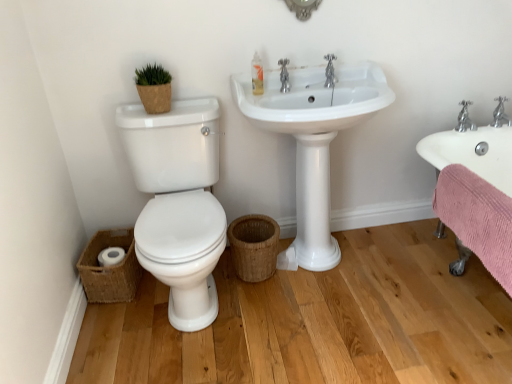
Question: Is white glossy sink at center, the first sink positioned from the left, looking in the opposite direction of white glossy toilet at left?

Choices:
 (A) no
 (B) yes

Answer: (A)

Question: Can white glossy toilet at left be found inside white glossy sink at center, placed as the second sink when sorted from right to left?

Choices:
 (A) yes
 (B) no

Answer: (B)

Question: Is white glossy sink at center, the first sink positioned from the left, at the left side of white glossy toilet at left?

Choices:
 (A) no
 (B) yes

Answer: (A)

Question: Does white glossy sink at center, the first sink positioned from the left, turn towards white glossy toilet at left?

Choices:
 (A) no
 (B) yes

Answer: (A)

Question: Can you confirm if white glossy sink at center, placed as the second sink when sorted from right to left, is taller than white glossy toilet at left?

Choices:
 (A) no
 (B) yes

Answer: (B)

Question: Is white glossy toilet at left bigger or smaller than woven brown basket at lower left, arranged as the 1th basket when viewed from the left?

Choices:
 (A) big
 (B) small

Answer: (A)

Question: Looking at their shapes, would you say white glossy toilet at left is wider or thinner than woven brown basket at lower left, arranged as the 1th basket when viewed from the left?

Choices:
 (A) wide
 (B) thin

Answer: (A)

Question: Choose the correct answer: Is white glossy toilet at left inside woven brown basket at lower left, which is counted as the 2th basket, starting from the right, or outside it?

Choices:
 (A) inside
 (B) outside

Answer: (B)

Question: Visually, is white glossy toilet at left positioned to the left or to the right of woven brown basket at lower left, which is counted as the 2th basket, starting from the right?

Choices:
 (A) left
 (B) right

Answer: (B)

Question: From the image's perspective, is woven brown basket at lower left, which is counted as the 2th basket, starting from the right, above or below white glossy toilet at left?

Choices:
 (A) below
 (B) above

Answer: (A)

Question: Is woven brown basket at lower left, which is counted as the 2th basket, starting from the right, in front of or behind white glossy toilet at left in the image?

Choices:
 (A) front
 (B) behind

Answer: (B)

Question: Would you say woven brown basket at lower left, which is counted as the 2th basket, starting from the right, is inside or outside white glossy toilet at left?

Choices:
 (A) outside
 (B) inside

Answer: (A)

Question: Based on their sizes in the image, would you say woven brown basket at lower left, which is counted as the 2th basket, starting from the right, is bigger or smaller than white glossy toilet at left?

Choices:
 (A) big
 (B) small

Answer: (B)

Question: Does point (350, 120) appear closer or farther from the camera than point (94, 268)?

Choices:
 (A) closer
 (B) farther

Answer: (A)

Question: From a real-world perspective, is white glossy sink at center, the first sink positioned from the left, physically located above or below woven brown basket at lower left, arranged as the 1th basket when viewed from the left?

Choices:
 (A) below
 (B) above

Answer: (B)